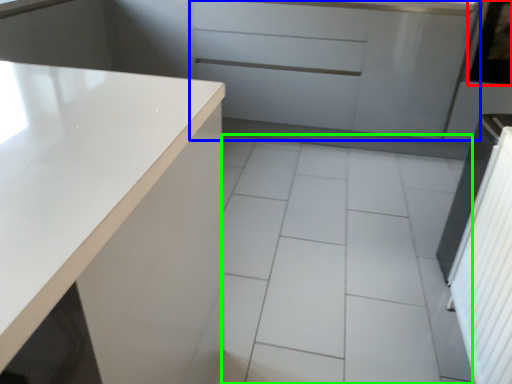
Question: Which object is positioned farthest from window screen (highlighted by a red box)? Select from cabinetry (highlighted by a blue box) and ceramic tile (highlighted by a green box).

Choices:
 (A) cabinetry
 (B) ceramic tile

Answer: (B)